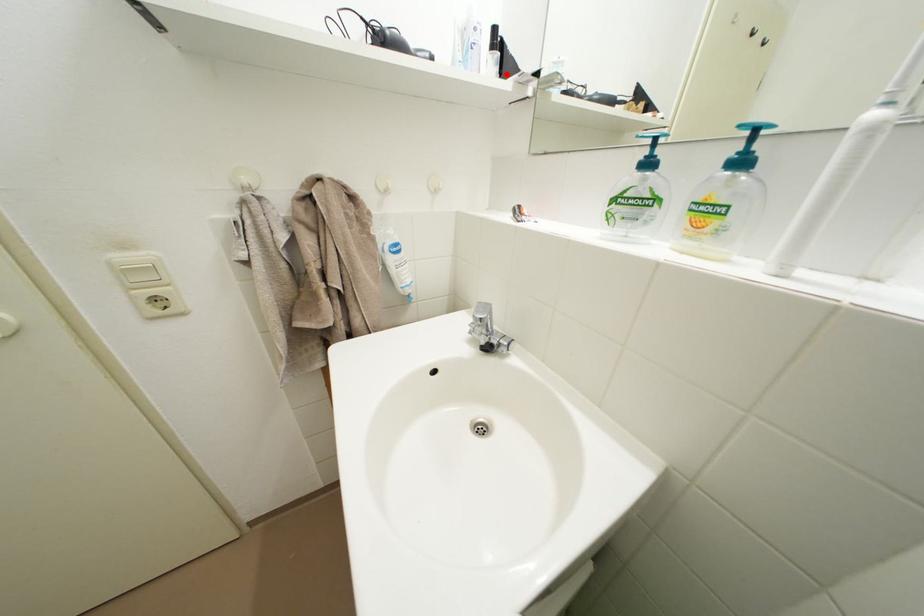
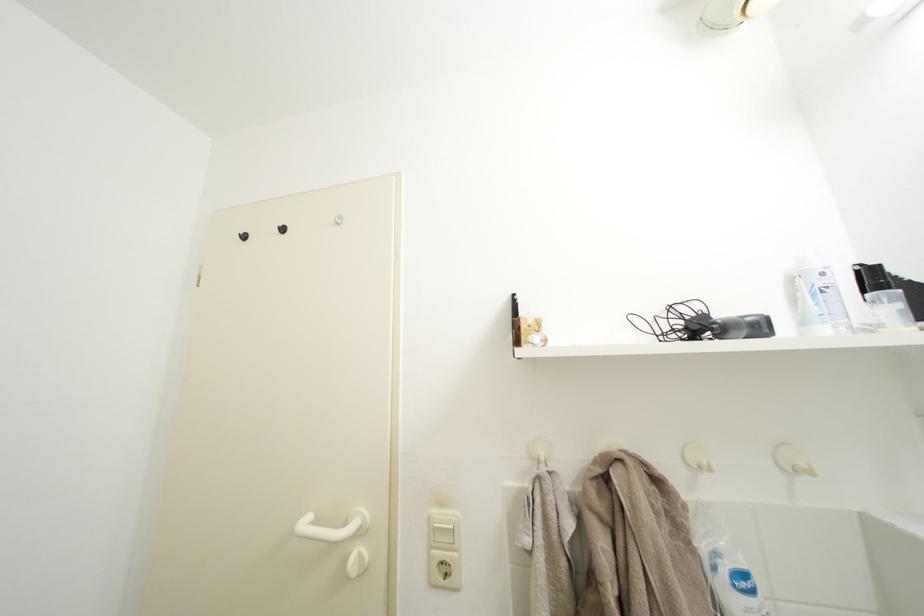
Locate, in the second image, the point that corresponds to the highlighted location in the first image.

(910, 310)